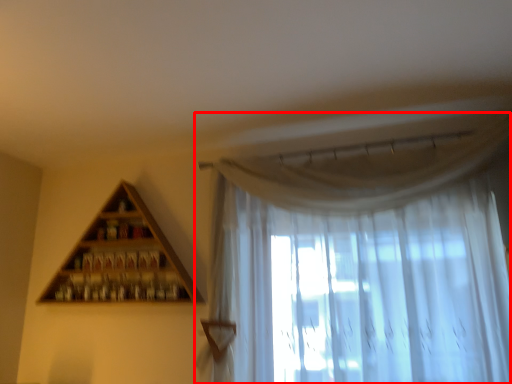
Question: Where is curtain (annotated by the red box) located in relation to shelf in the image?

Choices:
 (A) right
 (B) left

Answer: (A)